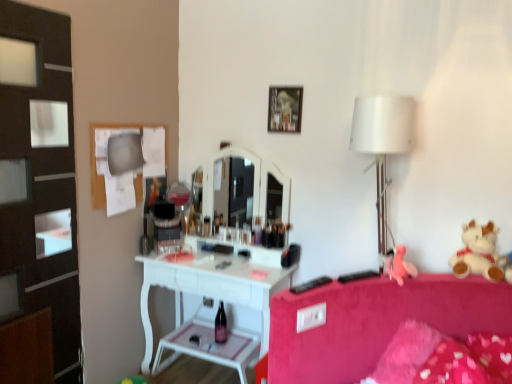
Question: Can you confirm if white plush teddy bear at right is wider than wooden picture frame at upper center?

Choices:
 (A) yes
 (B) no

Answer: (A)

Question: Is white plush teddy bear at right outside of wooden picture frame at upper center?

Choices:
 (A) no
 (B) yes

Answer: (B)

Question: From the image's perspective, would you say white plush teddy bear at right is positioned over wooden picture frame at upper center?

Choices:
 (A) yes
 (B) no

Answer: (B)

Question: From a real-world perspective, is white plush teddy bear at right below wooden picture frame at upper center?

Choices:
 (A) no
 (B) yes

Answer: (B)

Question: Considering the relative sizes of white plush teddy bear at right and wooden picture frame at upper center in the image provided, is white plush teddy bear at right thinner than wooden picture frame at upper center?

Choices:
 (A) no
 (B) yes

Answer: (A)

Question: Does white plush teddy bear at right have a smaller size compared to wooden picture frame at upper center?

Choices:
 (A) no
 (B) yes

Answer: (A)

Question: Can you confirm if wooden picture frame at upper center is wider than black plastic remote control at lower right, positioned as the second remote control in left-to-right order?

Choices:
 (A) no
 (B) yes

Answer: (A)

Question: Is wooden picture frame at upper center bigger than black plastic remote control at lower right, positioned as the second remote control in left-to-right order?

Choices:
 (A) no
 (B) yes

Answer: (B)

Question: Is wooden picture frame at upper center aimed at black plastic remote control at lower right, which appears as the first remote control when viewed from the right?

Choices:
 (A) no
 (B) yes

Answer: (A)

Question: Is wooden picture frame at upper center far from black plastic remote control at lower right, positioned as the second remote control in left-to-right order?

Choices:
 (A) no
 (B) yes

Answer: (A)

Question: Is wooden picture frame at upper center to the right of black plastic remote control at lower right, which appears as the first remote control when viewed from the right, from the viewer's perspective?

Choices:
 (A) yes
 (B) no

Answer: (B)

Question: Is black plastic remote control at lower right, which appears as the first remote control when viewed from the right, completely or partially inside wooden picture frame at upper center?

Choices:
 (A) no
 (B) yes

Answer: (A)

Question: From a real-world perspective, is white plush teddy bear at right on top of pink fabric teddy bear at right?

Choices:
 (A) no
 (B) yes

Answer: (B)